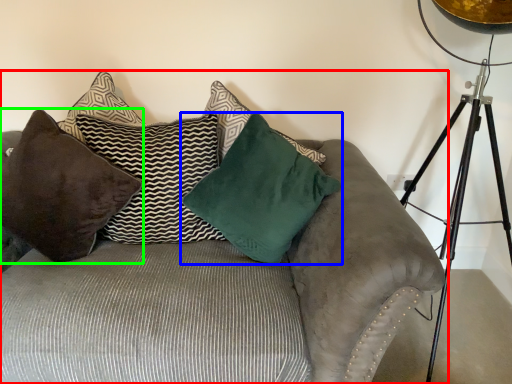
Question: Which object is the closest to the studio couch (highlighted by a red box)? Choose among these: pillow (highlighted by a blue box) or pillow (highlighted by a green box).

Choices:
 (A) pillow
 (B) pillow

Answer: (B)